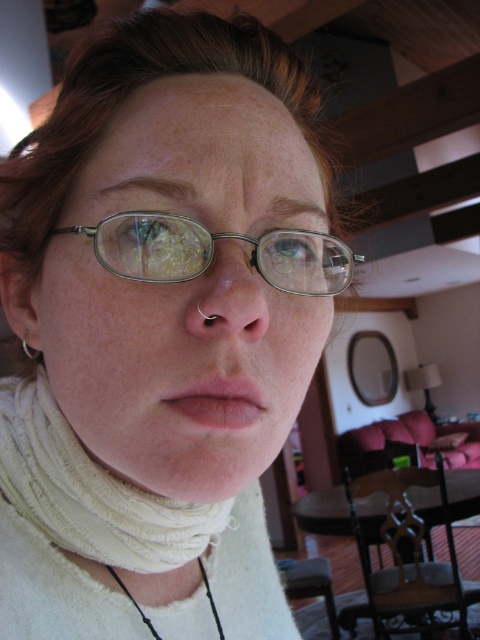
Between matte silver glasses at center and pink matte lips at center, which one is positioned higher?

matte silver glasses at center is above.

Between point (113, 410) and point (243, 406), which one is positioned behind?

Point (113, 410)

Is point (56, 396) closer to viewer compared to point (230, 422)?

No, (56, 396) is further to viewer.

The width and height of the screenshot is (480, 640). Find the location of `matte silver glasses at center`. matte silver glasses at center is located at coordinates 172,362.

Between point (216, 208) and point (2, 436), which one is positioned in front?

Point (216, 208) is more forward.

Based on the photo, who is taller, matte silver glasses at center or white ribbed turtleneck at center?

Standing taller between the two is matte silver glasses at center.

Is point (157, 412) farther from camera compared to point (128, 541)?

No, it is not.

You are a GUI agent. You are given a task and a screenshot of the screen. Output one action in this format:
    pyautogui.click(x=<x>, y=<y>)
    Task: Click on the matte silver glasses at center
    The height and width of the screenshot is (640, 480).
    Given the screenshot: What is the action you would take?
    pyautogui.click(x=172, y=362)

Based on the photo, is metallic silver glasses at center to the left of pink matte lips at center from the viewer's perspective?

Incorrect, metallic silver glasses at center is not on the left side of pink matte lips at center.

Who is more distant from viewer, (336, 244) or (229, 410)?

Positioned behind is point (336, 244).

The width and height of the screenshot is (480, 640). In order to click on metallic silver glasses at center in this screenshot , I will do `click(214, 252)`.